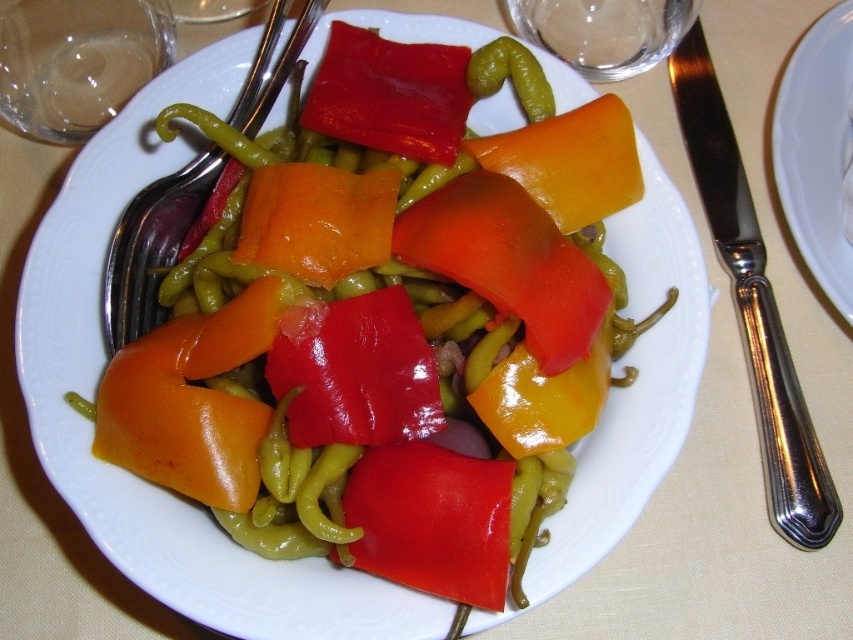
Question: Is silver metallic knife at upper right to the left of white glossy plate at upper right from the viewer's perspective?

Choices:
 (A) yes
 (B) no

Answer: (A)

Question: Can you confirm if silver metallic fork at left is positioned to the right of glossy orange carrot at center?

Choices:
 (A) no
 (B) yes

Answer: (A)

Question: Which object is closer to the camera taking this photo?

Choices:
 (A) silver metallic fork at left
 (B) yellow matte carrot at center

Answer: (B)

Question: Which point is farther from the camera taking this photo?

Choices:
 (A) click(339, 188)
 (B) click(759, 410)
 (C) click(241, 237)
 (D) click(630, 193)

Answer: (B)

Question: Which object appears closest to the camera in this image?

Choices:
 (A) yellow matte carrot at center
 (B) white glossy plate at upper right

Answer: (A)

Question: Does shiny plastic peppers at center appear on the left side of white glossy plate at upper right?

Choices:
 (A) no
 (B) yes

Answer: (B)